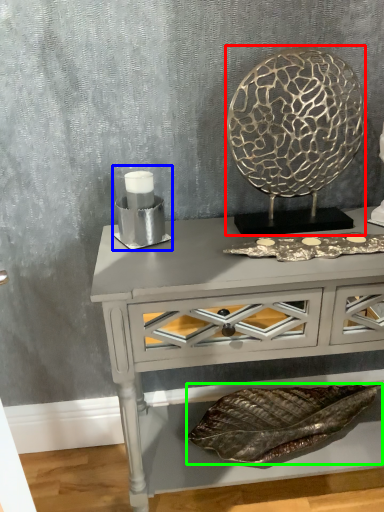
Question: Which object is positioned farthest from round table (highlighted by a red box)? Select from candle holder (highlighted by a blue box) and material (highlighted by a green box).

Choices:
 (A) candle holder
 (B) material

Answer: (B)